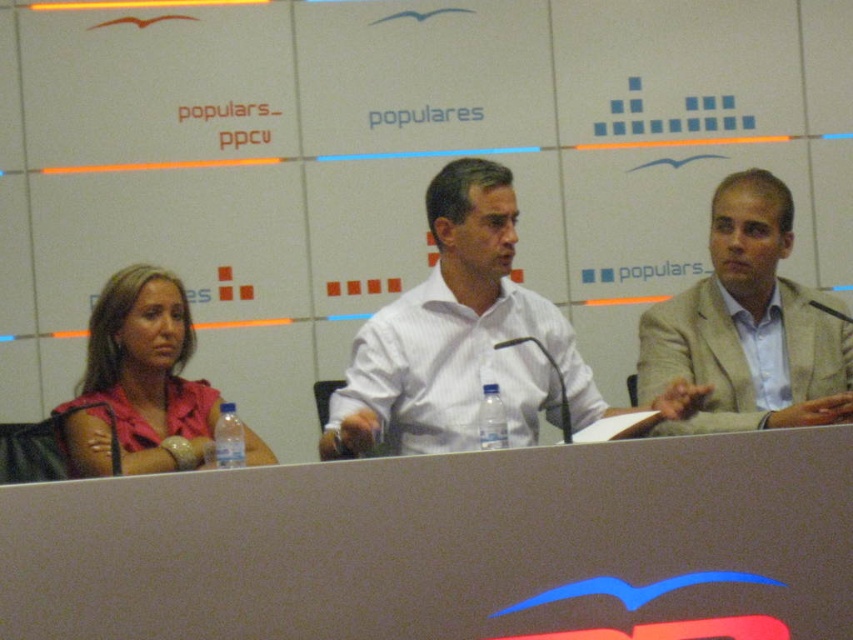
You are attending a press conference and want to take a photo of the speaker wearing the white striped shirt at center. The camera you have can only focus on objects within a 0.1 radius around the point specified. Is the white striped shirt at center within the focus range of the camera set to point (460, 339)?

The white striped shirt at center is located exactly at point (460, 339), so it will be within the focus range of the camera set to that point since the radius is 0.1, which includes the exact coordinates.